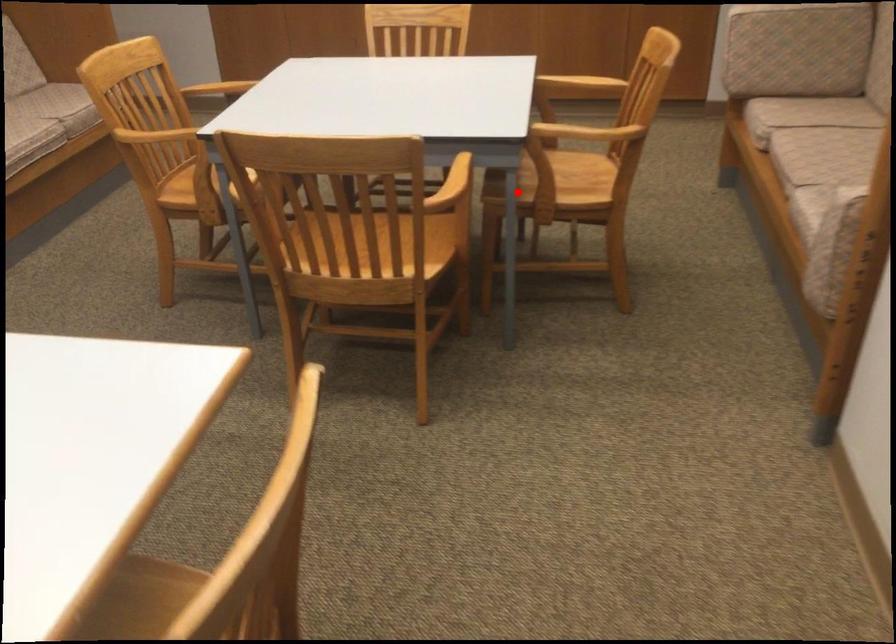
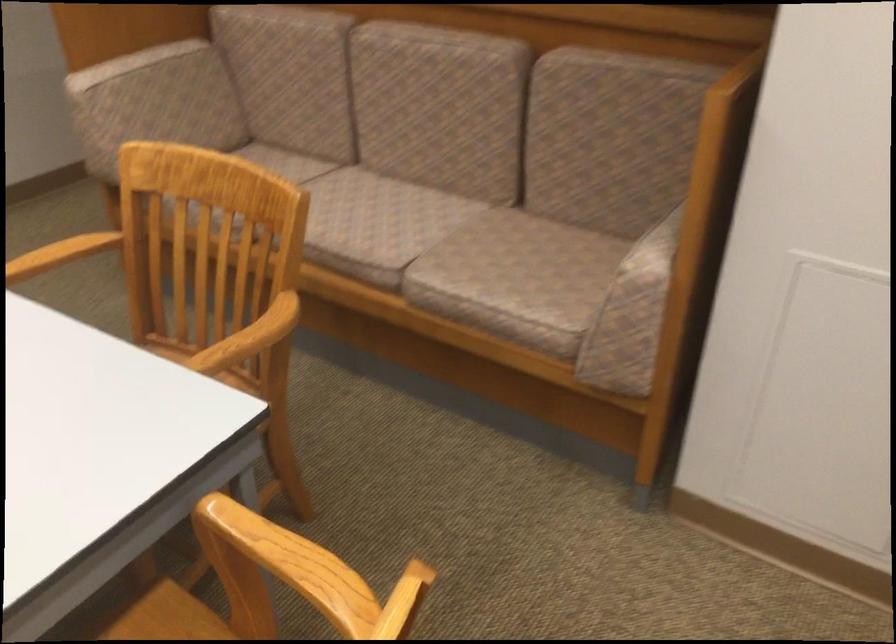
Where in the second image is the point corresponding to the highlighted location from the first image?

(259, 498)